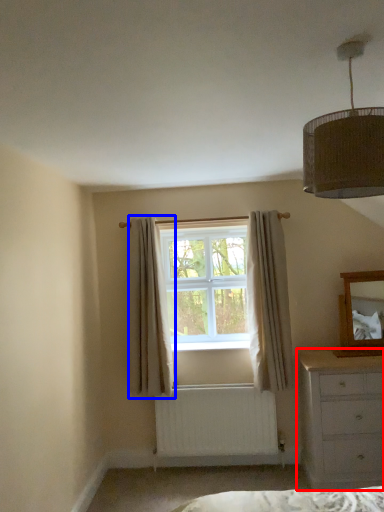
Question: Which of the following is the closest to the observer, chest of drawers (highlighted by a red box) or curtain (highlighted by a blue box)?

Choices:
 (A) chest of drawers
 (B) curtain

Answer: (A)